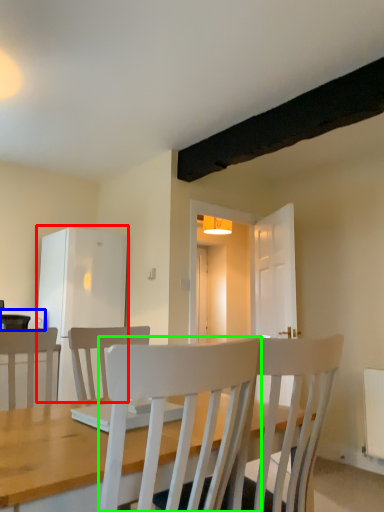
Question: Considering the real-world distances, which object is farthest from fridge (highlighted by a red box)? appliance (highlighted by a blue box) or chair (highlighted by a green box)?

Choices:
 (A) appliance
 (B) chair

Answer: (B)